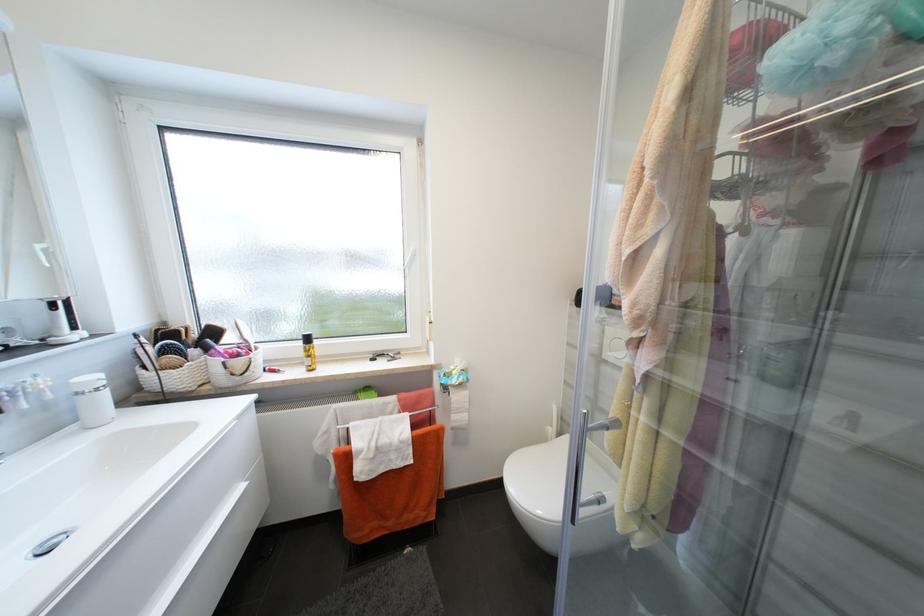
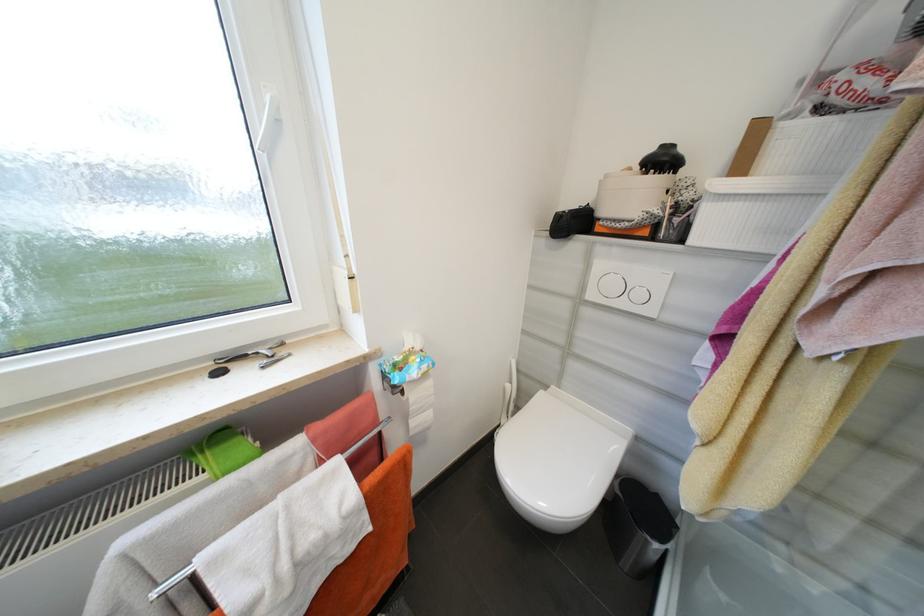
Where in the second image is the point corresponding to the point at 467,379 from the first image?

(430, 368)